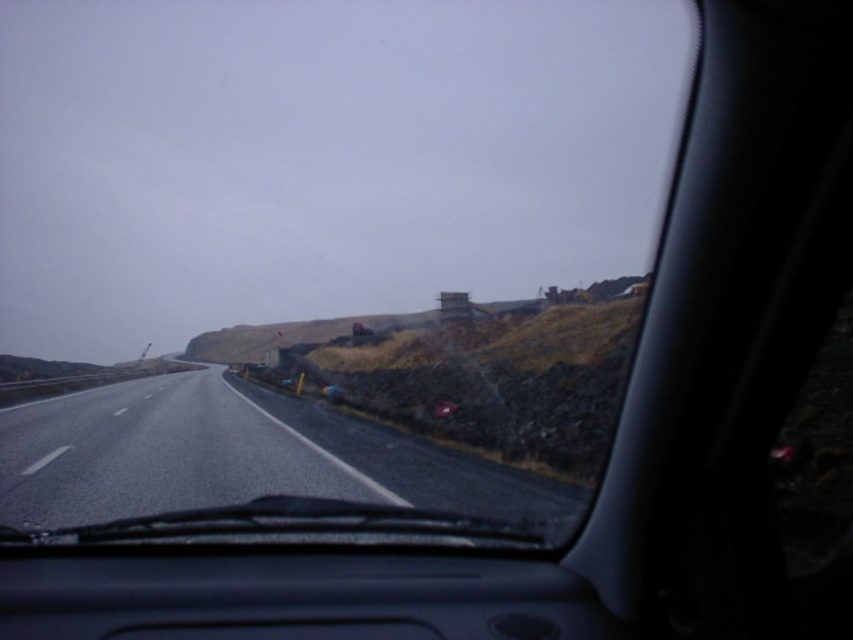
You are driving a car and need to check your surroundings. Which object, the transparent glass windshield at center or the black asphalt highway at center, would block your view of the road ahead more?

The transparent glass windshield at center is larger in size than the black asphalt highway at center, so it would block your view of the road ahead more.

You are a driver trying to navigate a wet road. You notice a point at coordinates (328, 248) on your vehicle screen. What object is located at that point?

The transparent glass windshield at center is located at point (328, 248).

In the scene shown: You are driving a car and looking through the windshield. There are two points marked on the road ahead. The first point is at coordinates point (x=409, y=200) and the second is at point (x=146, y=477). Which point is closer to your car?

Point (x=409, y=200) is closer to your car because it is further to the viewer than point (x=146, y=477).